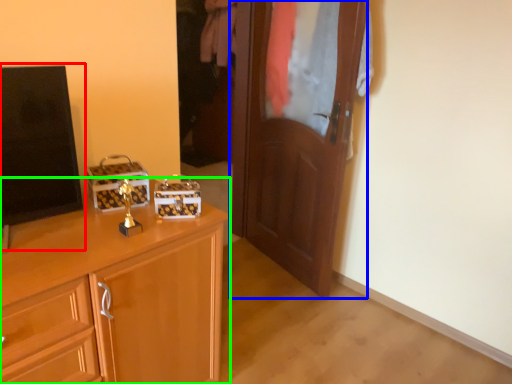
Question: Which object is positioned farthest from tv show (highlighted by a red box)? Select from door (highlighted by a blue box) and cabinetry (highlighted by a green box).

Choices:
 (A) door
 (B) cabinetry

Answer: (A)